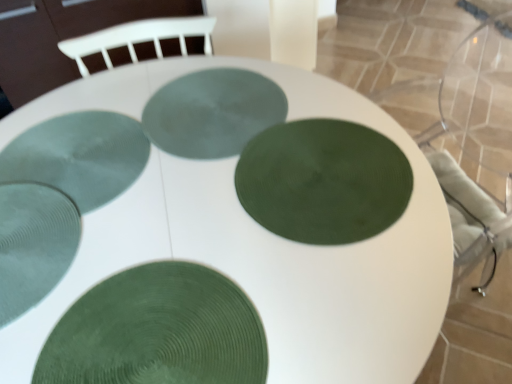
The width and height of the screenshot is (512, 384). I want to click on vacant space in front of green textured glass plate at center, arranged as the fourth glass plate when viewed from the front, so click(89, 276).